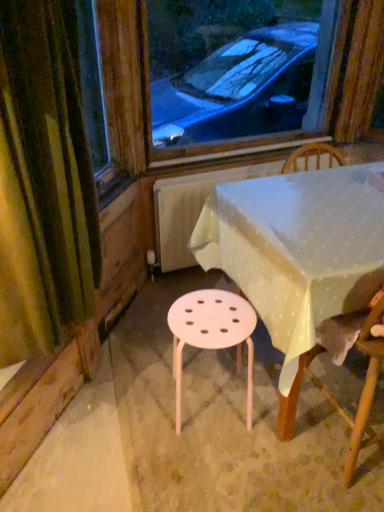
Question: Should I look upward or downward to see wooden chair at lower right?

Choices:
 (A) down
 (B) up

Answer: (A)

Question: From a real-world perspective, is green fabric curtain at left beneath wooden chair at lower right?

Choices:
 (A) no
 (B) yes

Answer: (A)

Question: Does green fabric curtain at left have a lesser width compared to wooden chair at lower right?

Choices:
 (A) no
 (B) yes

Answer: (B)

Question: Are green fabric curtain at left and wooden chair at lower right beside each other?

Choices:
 (A) no
 (B) yes

Answer: (A)

Question: Considering the relative sizes of green fabric curtain at left and wooden chair at lower right in the image provided, is green fabric curtain at left wider than wooden chair at lower right?

Choices:
 (A) yes
 (B) no

Answer: (B)

Question: Considering the relative sizes of green fabric curtain at left and wooden chair at lower right in the image provided, is green fabric curtain at left bigger than wooden chair at lower right?

Choices:
 (A) yes
 (B) no

Answer: (B)

Question: From the image's perspective, is green fabric curtain at left located above wooden chair at lower right?

Choices:
 (A) yes
 (B) no

Answer: (A)

Question: From the image's perspective, is white plastic table at center above pink plastic stool at center?

Choices:
 (A) yes
 (B) no

Answer: (A)

Question: Is white plastic table at center positioned behind pink plastic stool at center?

Choices:
 (A) yes
 (B) no

Answer: (B)

Question: Can you confirm if white plastic table at center is thinner than pink plastic stool at center?

Choices:
 (A) yes
 (B) no

Answer: (B)

Question: Is white plastic table at center facing towards pink plastic stool at center?

Choices:
 (A) no
 (B) yes

Answer: (A)

Question: Does white plastic table at center have a larger size compared to pink plastic stool at center?

Choices:
 (A) yes
 (B) no

Answer: (A)

Question: From a real-world perspective, is white plastic table at center positioned over pink plastic stool at center based on gravity?

Choices:
 (A) yes
 (B) no

Answer: (A)

Question: Considering the relative sizes of green fabric curtain at left and white plastic table at center in the image provided, is green fabric curtain at left wider than white plastic table at center?

Choices:
 (A) yes
 (B) no

Answer: (B)